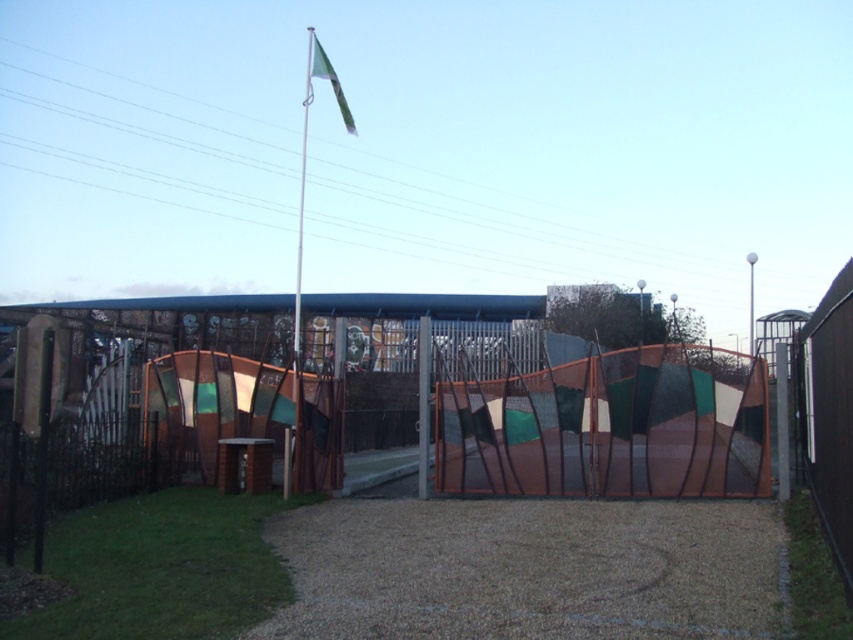
Does white metallic flag pole at center have a smaller size compared to green fabric flag at upper center?

No, white metallic flag pole at center is not smaller than green fabric flag at upper center.

Consider the image. Can you confirm if white metallic flag pole at center is positioned to the right of green fabric flag at upper center?

No, white metallic flag pole at center is not to the right of green fabric flag at upper center.

What do you see at coordinates (302, 204) in the screenshot?
I see `white metallic flag pole at center` at bounding box center [302, 204].

The height and width of the screenshot is (640, 853). Identify the location of white metallic flag pole at center. [302, 204].

Based on the photo, does textured brown fence at center appear on the right side of white metallic flag pole at center?

Correct, you'll find textured brown fence at center to the right of white metallic flag pole at center.

Between textured brown fence at center and white metallic flag pole at center, which one is positioned lower?

textured brown fence at center is below.

Who is more forward, (727, 378) or (300, 285)?

Point (727, 378) is in front.

This screenshot has width=853, height=640. What are the coordinates of `textured brown fence at center` in the screenshot? It's located at (608, 426).

This screenshot has height=640, width=853. What are the coordinates of `textured brown fence at center` in the screenshot? It's located at (608, 426).

Does textured brown fence at center lie in front of green fabric flag at upper center?

Yes, it is.

Locate an element on the screen. Image resolution: width=853 pixels, height=640 pixels. textured brown fence at center is located at coordinates (608, 426).